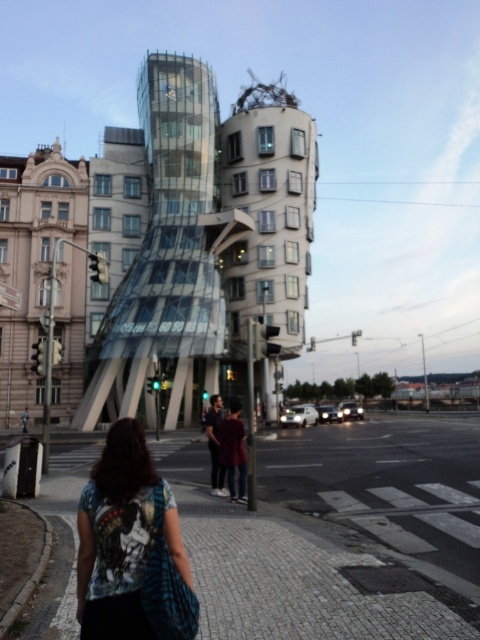
Is the position of paved stone at center less distant than that of transparent glass building at center?

Yes, paved stone at center is closer to the viewer.

Between paved stone at center and transparent glass building at center, which one has more height?

With more height is transparent glass building at center.

This screenshot has width=480, height=640. What do you see at coordinates (337, 532) in the screenshot? I see `paved stone at center` at bounding box center [337, 532].

Identify the location of paved stone at center. (337, 532).

What do you see at coordinates (204, 244) in the screenshot? The image size is (480, 640). I see `transparent glass building at center` at bounding box center [204, 244].

Is transparent glass building at center wider than blue printed t-shirt at lower left?

Correct, the width of transparent glass building at center exceeds that of blue printed t-shirt at lower left.

Describe the element at coordinates (204, 244) in the screenshot. I see `transparent glass building at center` at that location.

Identify the location of transparent glass building at center. This screenshot has width=480, height=640. (204, 244).

Is matte beige building at left in front of blue printed t-shirt at lower left?

No, it is behind blue printed t-shirt at lower left.

At what (x,y) coordinates should I click in order to perform the action: click on matte beige building at left. Please return your answer as a coordinate pair (x, y). The height and width of the screenshot is (640, 480). Looking at the image, I should click on (33, 260).

You are a GUI agent. You are given a task and a screenshot of the screen. Output one action in this format:
    pyautogui.click(x=<x>, y=<y>)
    Task: Click on the matte beige building at left
    The image size is (480, 640).
    Given the screenshot: What is the action you would take?
    pyautogui.click(x=33, y=260)

The height and width of the screenshot is (640, 480). Find the location of `matte beige building at left`. matte beige building at left is located at coordinates (33, 260).